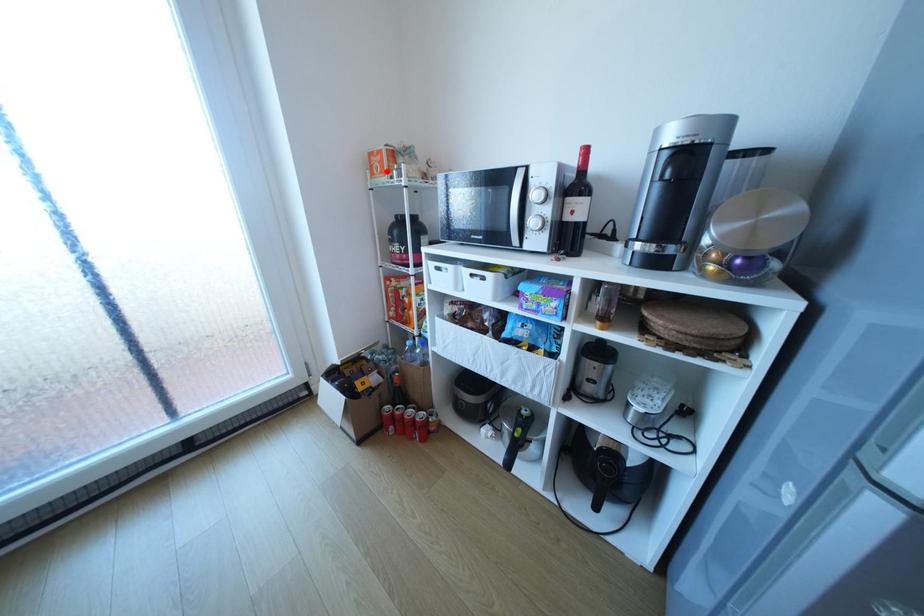
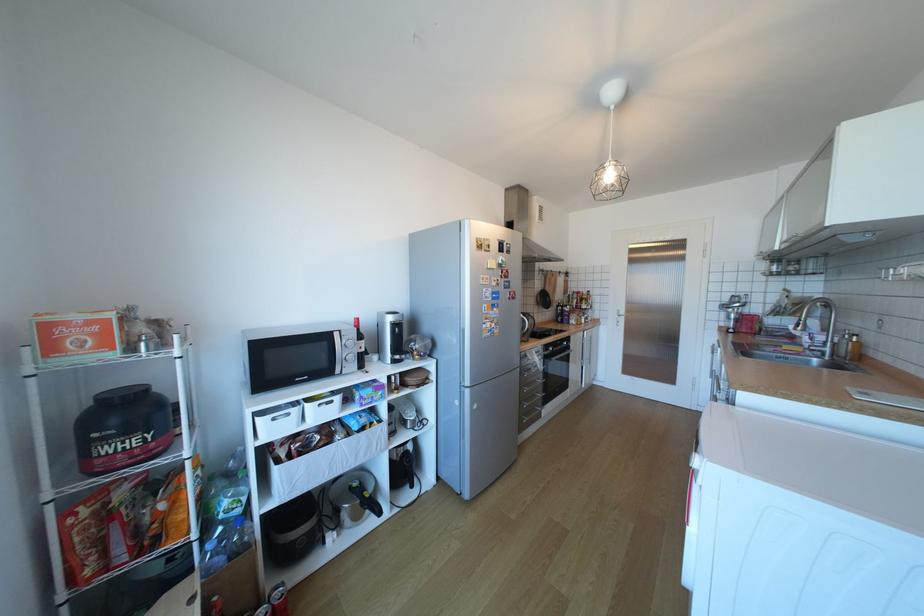
Where in the second image is the point corresponding to the highlighted location from the first image?

(91, 346)